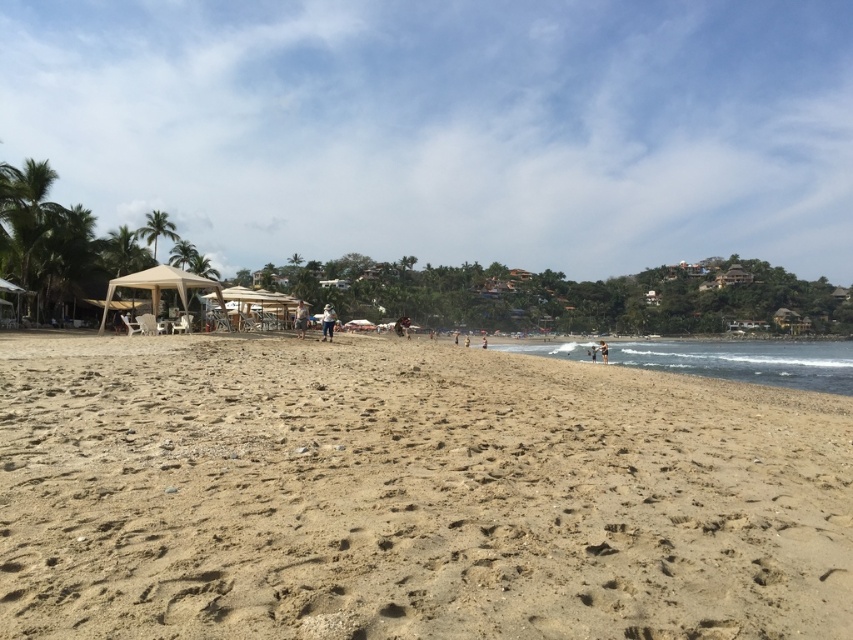
You are a photographer planning to capture a wide shot of the beach scene. Given that the light brown sand at center occupies a larger area than the brown fabric umbrella at center, how would you position your camera to ensure both elements are clearly visible in the frame?

Since the light brown sand at center is bigger than the brown fabric umbrella at center, position the camera so that the light brown sand at center fills the lower portion of the frame while leaving space above for the brown fabric umbrella at center to be visible without overcrowding the composition.

You are standing on the beach and want to walk to both the point at coordinates (276, 388) and the point at (606, 353). Which point will you reach first if you start walking towards them from your current position?

You will reach the point at coordinates (276, 388) first because it is closer to you than the point at (606, 353).